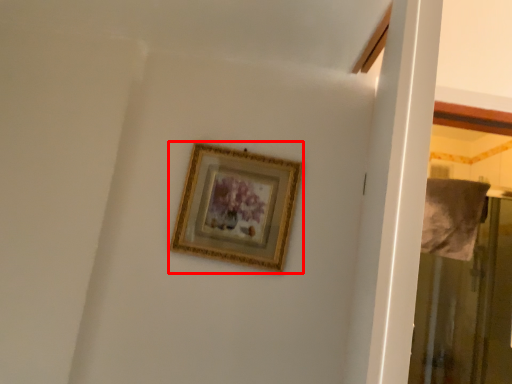
Question: Observing the image, what is the correct spatial positioning of picture frame (annotated by the red box) in reference to screen door?

Choices:
 (A) left
 (B) right

Answer: (A)